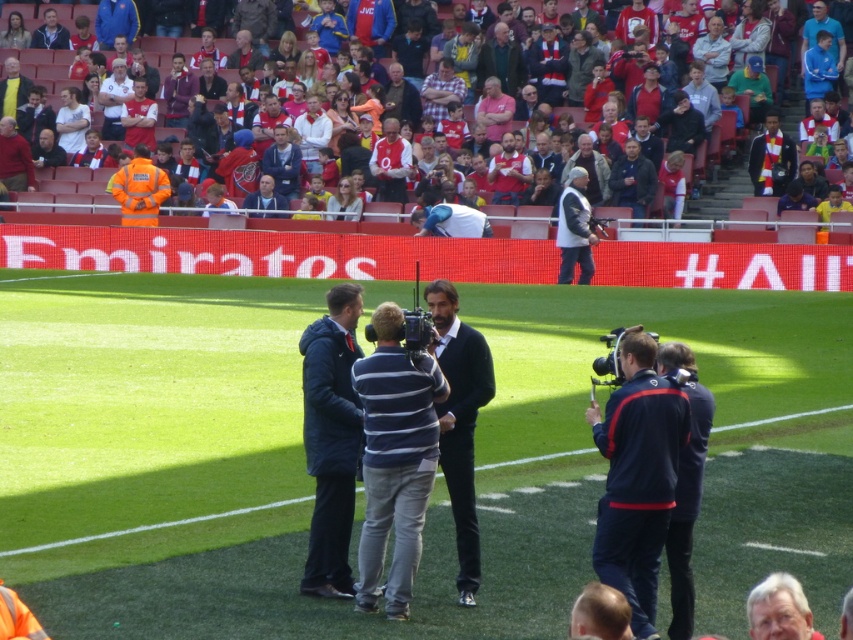
Question: Is red fabric seats at upper center bigger than gray hair at lower right?

Choices:
 (A) no
 (B) yes

Answer: (B)

Question: Estimate the real-world distances between objects in this image. Which object is closer to the navy blue jacket at center?

Choices:
 (A) white fabric shirt at center
 (B) dark blue sweater at center

Answer: (B)

Question: From the image, what is the correct spatial relationship of navy blue jacket at center in relation to white fabric shirt at center?

Choices:
 (A) left
 (B) right

Answer: (A)

Question: Which point is farther to the camera?

Choices:
 (A) (410, 164)
 (B) (465, 460)
 (C) (614, 508)

Answer: (A)

Question: Does dark gray leather jacket at center have a larger size compared to white jersey at center?

Choices:
 (A) yes
 (B) no

Answer: (A)

Question: Among these objects, which one is farthest from the camera?

Choices:
 (A) dark blue sweater at center
 (B) navy blue jacket at center

Answer: (B)